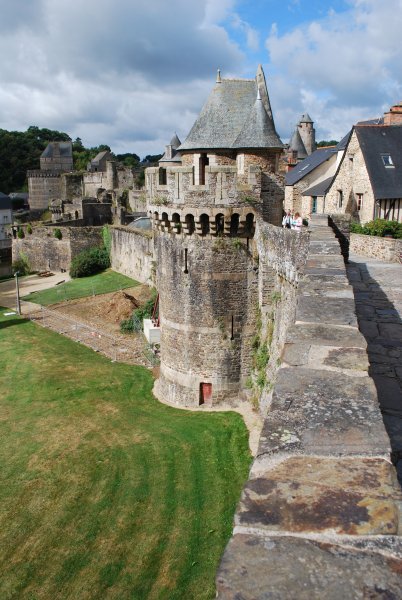
At what (x,y) coordinates should I click in order to perform the action: click on door. Please return your answer as a coordinate pair (x, y). The height and width of the screenshot is (600, 402). Looking at the image, I should click on (206, 393), (314, 206), (205, 162).